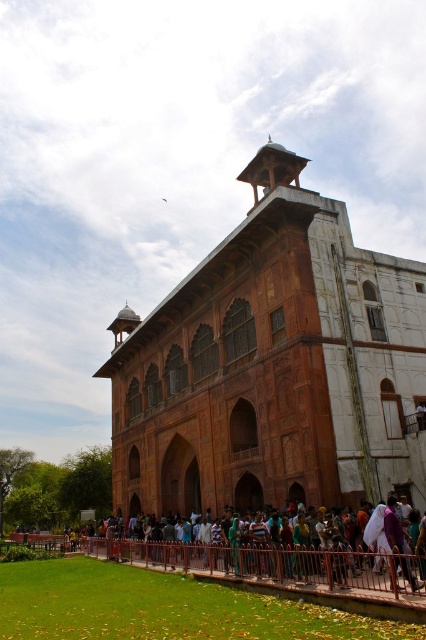
Is brown stone palace at center behind brown metal fence at lower center?

That is True.

Based on the photo, who is positioned more to the right, brown stone palace at center or brown metal fence at lower center?

Positioned to the right is brown stone palace at center.

Locate an element on the screen. Image resolution: width=426 pixels, height=640 pixels. brown stone palace at center is located at coordinates (273, 365).

Identify the location of brown stone palace at center. The height and width of the screenshot is (640, 426). (273, 365).